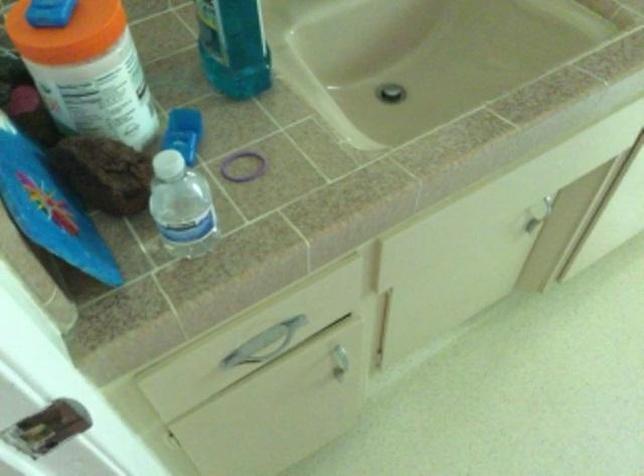
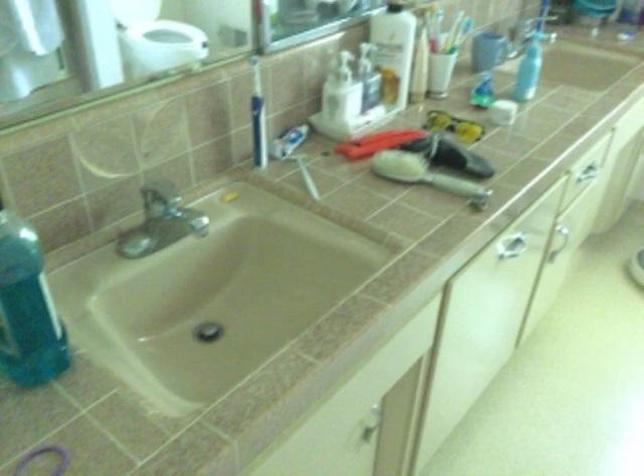
Looking at this image, the images are taken continuously from a first-person perspective. In which direction is your viewpoint rotating?

The camera rotated toward right-up.